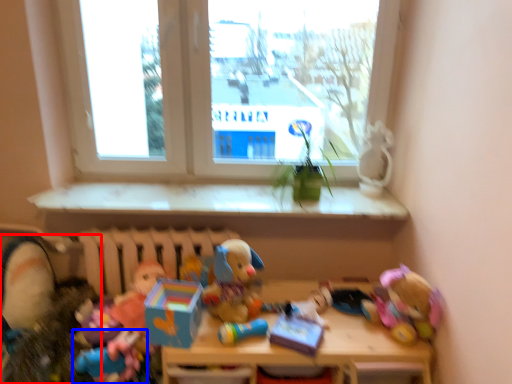
Question: Which object appears closest to the camera in this image, toy (highlighted by a red box) or toy (highlighted by a blue box)?

Choices:
 (A) toy
 (B) toy

Answer: (A)